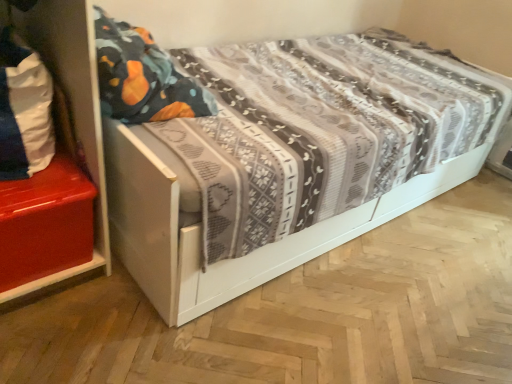
What do you see at coordinates (325, 22) in the screenshot? I see `white wood bed at center` at bounding box center [325, 22].

Measure the distance between shiny red chest at left and camera.

The distance of shiny red chest at left from camera is 1.13 meters.

This screenshot has width=512, height=384. Find the location of `white wood bed at center`. white wood bed at center is located at coordinates (325, 22).

Who is bigger, white fabric pillow at left or shiny red chest at left?

Bigger between the two is shiny red chest at left.

This screenshot has height=384, width=512. In order to click on shelf that is on the left side of white fabric pillow at left in this screenshot , I will do 45,223.

From a real-world perspective, does white fabric pillow at left stand above shiny red chest at left?

Correct, in the physical world, white fabric pillow at left is higher than shiny red chest at left.

Could you tell me if white fabric pillow at left is facing shiny red chest at left?

No, white fabric pillow at left is not aimed at shiny red chest at left.

Does point (0, 99) come closer to viewer compared to point (388, 19)?

Yes, it is in front of point (388, 19).

Considering the relative sizes of white fabric pillow at left and white wood bed at center in the image provided, is white fabric pillow at left shorter than white wood bed at center?

Yes, white fabric pillow at left is shorter than white wood bed at center.

Does white fabric pillow at left come in front of white wood bed at center?

That is False.

From the image's perspective, between shiny red chest at left and white wood bed at center, which one is located above?

From the image's view, white wood bed at center is above.

Would you say shiny red chest at left is to the left or to the right of white wood bed at center in the picture?

shiny red chest at left is to the left of white wood bed at center.

Can you confirm if shiny red chest at left is smaller than white wood bed at center?

Yes, shiny red chest at left is smaller than white wood bed at center.

Could white wood bed at center be considered to be inside shiny red chest at left?

Definitely not — white wood bed at center is not inside shiny red chest at left.

Considering the sizes of shiny red chest at left and white fabric pillow at left in the image, is shiny red chest at left wider or thinner than white fabric pillow at left?

In the image, shiny red chest at left appears to be wider than white fabric pillow at left.

Would you say shiny red chest at left is a long distance from white fabric pillow at left?

shiny red chest at left is actually quite close to white fabric pillow at left.

From a real-world perspective, between shiny red chest at left and white fabric pillow at left, who is vertically lower?

shiny red chest at left is physically lower.

This screenshot has height=384, width=512. I want to click on material in front of the shiny red chest at left, so click(24, 110).

Is white wood bed at center oriented towards white fabric pillow at left?

Yes.

Identify the location of material above the white wood bed at center (from the image's perspective). (24, 110).

Which object is positioned more to the left, white wood bed at center or white fabric pillow at left?

white fabric pillow at left is more to the left.

Is point (176, 309) behind point (21, 61)?

Yes, point (176, 309) is farther from viewer.

Considering the sizes of objects white wood bed at center and shiny red chest at left in the image provided, who is smaller, white wood bed at center or shiny red chest at left?

Smaller between the two is shiny red chest at left.

Is shiny red chest at left located within white wood bed at center?

No, shiny red chest at left is not inside white wood bed at center.

Does point (324, 232) appear closer or farther from the camera than point (51, 271)?

Point (324, 232).

This screenshot has height=384, width=512. Identify the location of shelf below the white fabric pillow at left (from a real-world perspective). (45, 223).

Where is `material above the white wood bed at center (from the image's perspective)`? material above the white wood bed at center (from the image's perspective) is located at coordinates (24, 110).

When comparing their distances from white wood bed at center, does shiny red chest at left or white fabric pillow at left seem further?

shiny red chest at left.

Looking at the image, which one is located closer to white fabric pillow at left, shiny red chest at left or white wood bed at center?

shiny red chest at left is positioned closer to the anchor white fabric pillow at left.

Based on the photo, looking at the image, which one is located closer to white wood bed at center, white fabric pillow at left or shiny red chest at left?

white fabric pillow at left lies closer to white wood bed at center than the other object.

Which object lies nearer to the anchor point shiny red chest at left, white fabric pillow at left or white wood bed at center?

white fabric pillow at left is positioned closer to the anchor shiny red chest at left.

Based on their spatial positions, is white wood bed at center or shiny red chest at left closer to white fabric pillow at left?

shiny red chest at left lies closer to white fabric pillow at left than the other object.

Estimate the real-world distances between objects in this image. Which object is closer to shiny red chest at left, white wood bed at center or white fabric pillow at left?

white fabric pillow at left lies closer to shiny red chest at left than the other object.

Locate an element on the screen. The width and height of the screenshot is (512, 384). material between shiny red chest at left and white wood bed at center in the horizontal direction is located at coordinates (24, 110).